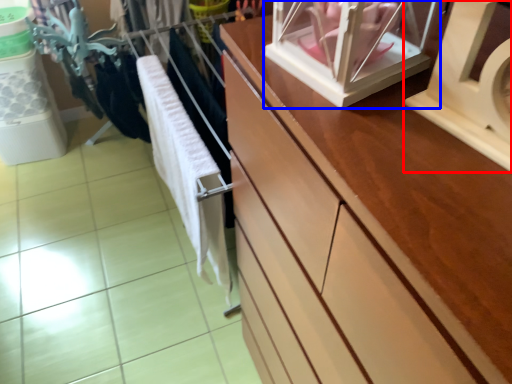
Question: Which object is further to the camera taking this photo, wide (highlighted by a red box) or glass box (highlighted by a blue box)?

Choices:
 (A) wide
 (B) glass box

Answer: (B)